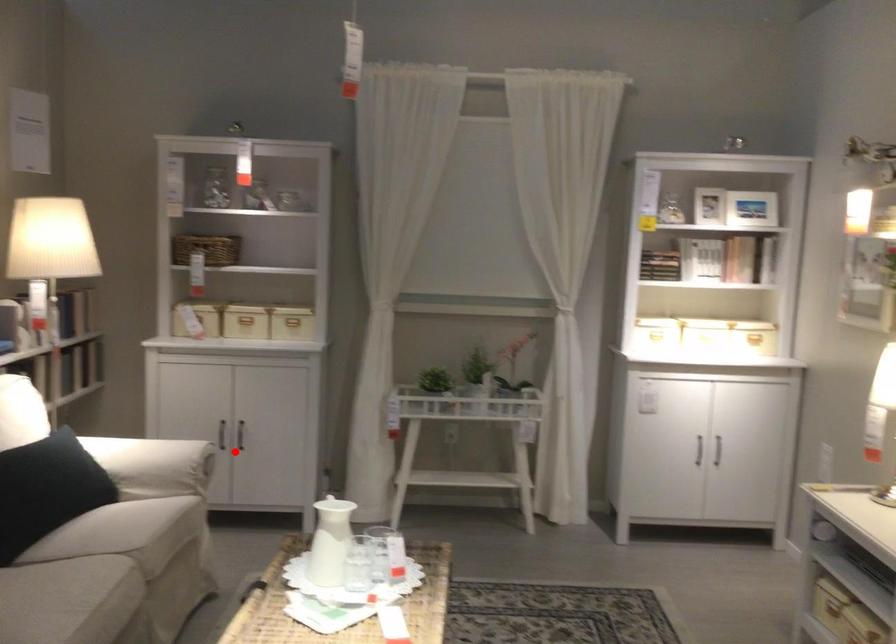
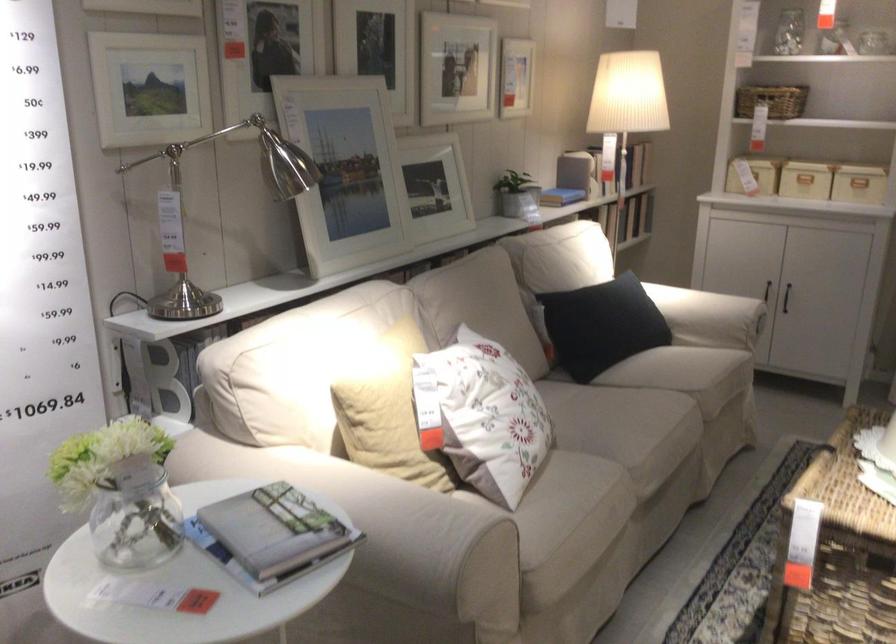
Question: I am providing you with two images of the same scene from different viewpoints. A red point is marked on the first image. Is the red point's position out of view in image 2?

Choices:
 (A) Yes
 (B) No

Answer: (B)